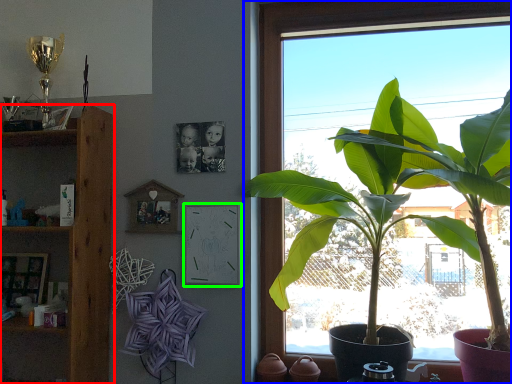
Question: Which object is the farthest from shelf (highlighted by a red box)? Choose among these: window (highlighted by a blue box) or picture frame (highlighted by a green box).

Choices:
 (A) window
 (B) picture frame

Answer: (A)